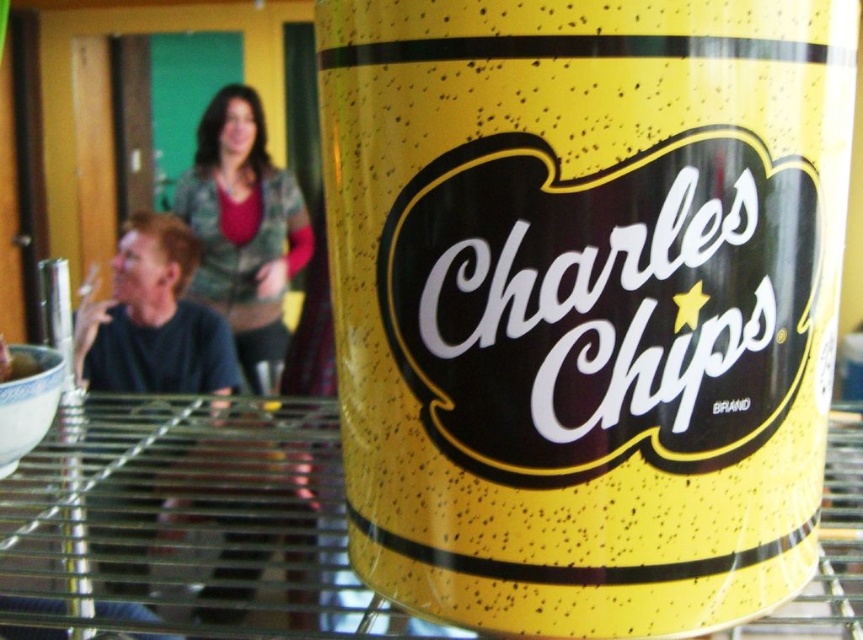
You are trying to place a small toy behind the transparent glass table at center so that it won t be seen from the front. Where should you position the toy relative to the yellow speckled can at center?

You should place the toy behind the yellow speckled can at center since it is in front of the transparent glass table at center, blocking the view from the front.

You are organizing a pantry and need to place the yellow speckled can at center and the green textured sweater at upper center. Given their sizes, which item should be placed on the lower shelf to ensure stability?

The yellow speckled can at center is larger than the green textured sweater at upper center, so it should be placed on the lower shelf for stability.